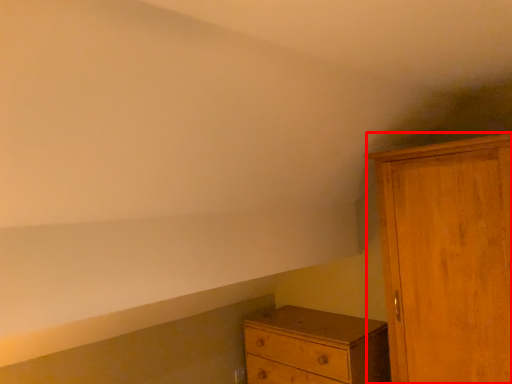
Question: From the image, what is the correct spatial relationship of cupboard (annotated by the red box) in relation to chest of drawers?

Choices:
 (A) left
 (B) right

Answer: (B)